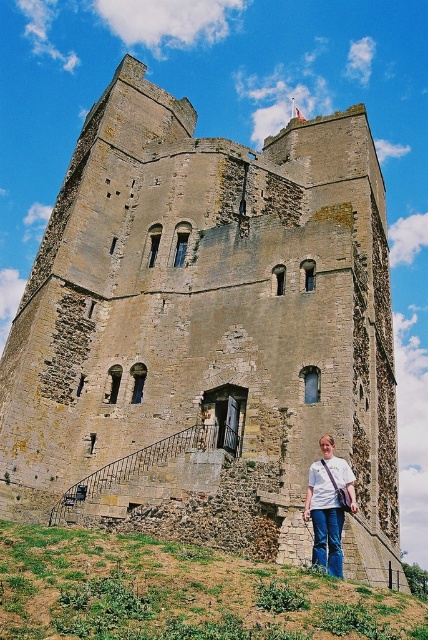
Does green grassy hillside at lower left have a lesser height compared to white cotton shirt at lower center?

Yes.

Does point (300, 627) come in front of point (333, 477)?

Yes, it is.

The image size is (428, 640). Find the location of `green grassy hillside at lower left`. green grassy hillside at lower left is located at coordinates (178, 593).